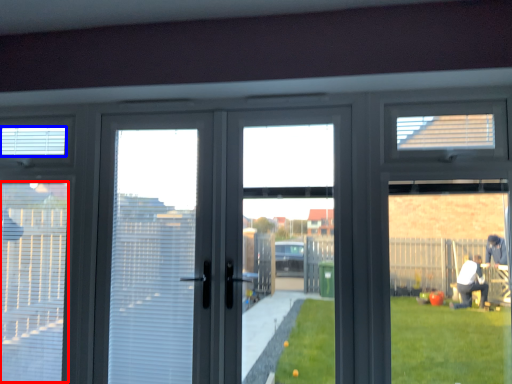
Question: Which point is further to the camera, blind (highlighted by a red box) or blind (highlighted by a blue box)?

Choices:
 (A) blind
 (B) blind

Answer: (B)